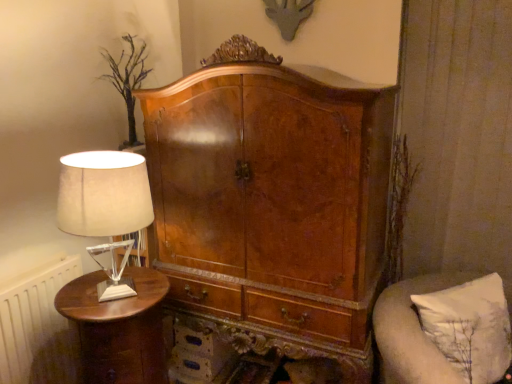
The width and height of the screenshot is (512, 384). What do you see at coordinates (412, 331) in the screenshot?
I see `white fabric pillow at right` at bounding box center [412, 331].

Locate an element on the screen. white fabric pillow at right is located at coordinates (412, 331).

Describe the element at coordinates (38, 328) in the screenshot. The width and height of the screenshot is (512, 384). I see `white painted radiator at left` at that location.

Measure the distance between point (64,300) and camera.

They are 4.78 feet apart.

The height and width of the screenshot is (384, 512). I want to click on white fabric pillow at right, so click(412, 331).

From a real-world perspective, which object stands above the other?

white fabric lampshade at left is physically above.

Who is smaller, shiny brown wood nightstand at left or white fabric lampshade at left?

Smaller between the two is white fabric lampshade at left.

How distant is shiny brown wood nightstand at left from white fabric lampshade at left?

The distance of shiny brown wood nightstand at left from white fabric lampshade at left is 14.38 inches.

Between shiny brown wood nightstand at left and white fabric lampshade at left, which one appears on the left side from the viewer's perspective?

Positioned to the left is shiny brown wood nightstand at left.

From the image's perspective, is white fabric lampshade at left located above or below white fabric pillow at right?

Clearly, from the image's perspective, white fabric lampshade at left is above white fabric pillow at right.

From a real-world perspective, does white fabric lampshade at left stand above white fabric pillow at right?

Correct, in the physical world, white fabric lampshade at left is higher than white fabric pillow at right.

Based on their positions, is white fabric lampshade at left located to the left or right of white fabric pillow at right?

Based on their positions, white fabric lampshade at left is located to the left of white fabric pillow at right.

Measure the distance between white fabric lampshade at left and white fabric pillow at right.

A distance of 38.64 inches exists between white fabric lampshade at left and white fabric pillow at right.

Image resolution: width=512 pixels, height=384 pixels. What are the coordinates of `furniture above the shiny brown wood nightstand at left (from a real-world perspective)` in the screenshot? It's located at (412, 331).

Considering the positions of objects white fabric pillow at right and shiny brown wood nightstand at left in the image provided, who is more to the right, white fabric pillow at right or shiny brown wood nightstand at left?

From the viewer's perspective, white fabric pillow at right appears more on the right side.

Would you say white fabric pillow at right is outside shiny brown wood nightstand at left?

Yes.

Between white fabric pillow at right and white painted radiator at left, which one has more height?

white painted radiator at left.

Looking at this image, from a real-world perspective, which object stands above the other?

white fabric pillow at right.

Considering the sizes of objects white fabric pillow at right and white painted radiator at left in the image provided, who is thinner, white fabric pillow at right or white painted radiator at left?

white painted radiator at left is thinner.

Is white fabric pillow at right further to the viewer compared to white painted radiator at left?

No, it is in front of white painted radiator at left.

Is white fabric lampshade at left at the back of white painted radiator at left?

No, white painted radiator at left is not facing away from white fabric lampshade at left.

Find the location of a particular element. radiator below the white fabric lampshade at left (from the image's perspective) is located at coordinates (38, 328).

How different are the orientations of white painted radiator at left and white fabric lampshade at left in degrees?

0.174 degrees separate the facing orientations of white painted radiator at left and white fabric lampshade at left.

Which is more to the right, white painted radiator at left or white fabric lampshade at left?

white fabric lampshade at left is more to the right.

Between shiny brown wood nightstand at left and white fabric pillow at right, which one has smaller width?

With smaller width is white fabric pillow at right.

Considering the relative sizes of shiny brown wood nightstand at left and white fabric pillow at right in the image provided, is shiny brown wood nightstand at left taller than white fabric pillow at right?

Correct, shiny brown wood nightstand at left is much taller as white fabric pillow at right.

You are a GUI agent. You are given a task and a screenshot of the screen. Output one action in this format:
    pyautogui.click(x=<x>, y=<y>)
    Task: Click on the furniture that appears above the shiny brown wood nightstand at left (from a real-world perspective)
    This screenshot has height=384, width=512.
    Given the screenshot: What is the action you would take?
    pyautogui.click(x=412, y=331)

Looking at the image, does shiny brown wood nightstand at left seem bigger or smaller compared to white painted radiator at left?

Considering their sizes, shiny brown wood nightstand at left takes up more space than white painted radiator at left.

Is shiny brown wood nightstand at left to the left or to the right of white painted radiator at left in the image?

In the image, shiny brown wood nightstand at left appears on the right side of white painted radiator at left.

Do you think shiny brown wood nightstand at left is within white painted radiator at left, or outside of it?

shiny brown wood nightstand at left is not inside white painted radiator at left, it's outside.

This screenshot has height=384, width=512. In order to click on table lamp to the right of shiny brown wood nightstand at left in this screenshot , I will do `click(104, 194)`.

The width and height of the screenshot is (512, 384). What are the coordinates of `furniture below the white fabric lampshade at left (from the image's perspective)` in the screenshot? It's located at (412, 331).

From the picture: Estimate the real-world distances between objects in this image. Which object is closer to white fabric pillow at right, white fabric lampshade at left or shiny brown wood nightstand at left?

The object closer to white fabric pillow at right is shiny brown wood nightstand at left.

From the image, which object appears to be nearer to white painted radiator at left, white fabric pillow at right or shiny brown wood nightstand at left?

The object closer to white painted radiator at left is shiny brown wood nightstand at left.

When comparing their distances from white fabric lampshade at left, does white fabric pillow at right or white painted radiator at left seem closer?

white painted radiator at left.

Estimate the real-world distances between objects in this image. Which object is further from white fabric pillow at right, shiny brown wood nightstand at left or white painted radiator at left?

Among the two, white painted radiator at left is located further to white fabric pillow at right.

Based on their spatial positions, is white painted radiator at left or shiny brown wood nightstand at left closer to white fabric lampshade at left?

shiny brown wood nightstand at left lies closer to white fabric lampshade at left than the other object.

From the picture: Based on their spatial positions, is white fabric pillow at right or white fabric lampshade at left closer to shiny brown wood nightstand at left?

white fabric lampshade at left is closer to shiny brown wood nightstand at left.

Looking at the image, which one is located further to white painted radiator at left, shiny brown wood nightstand at left or white fabric pillow at right?

Among the two, white fabric pillow at right is located further to white painted radiator at left.

From the image, which object appears to be farther from white fabric pillow at right, white painted radiator at left or shiny brown wood nightstand at left?

white painted radiator at left is positioned further to the anchor white fabric pillow at right.

Locate an element on the screen. This screenshot has width=512, height=384. radiator that lies between white fabric lampshade at left and shiny brown wood nightstand at left from top to bottom is located at coordinates (38, 328).

Image resolution: width=512 pixels, height=384 pixels. What are the coordinates of `nightstand situated between white painted radiator at left and white fabric pillow at right from left to right` in the screenshot? It's located at (119, 328).

You are a GUI agent. You are given a task and a screenshot of the screen. Output one action in this format:
    pyautogui.click(x=<x>, y=<y>)
    Task: Click on the table lamp between white painted radiator at left and white fabric pillow at right in the horizontal direction
    The image size is (512, 384).
    Given the screenshot: What is the action you would take?
    pyautogui.click(x=104, y=194)

Locate an element on the screen. The height and width of the screenshot is (384, 512). table lamp located between shiny brown wood nightstand at left and white fabric pillow at right in the left-right direction is located at coordinates pyautogui.click(x=104, y=194).